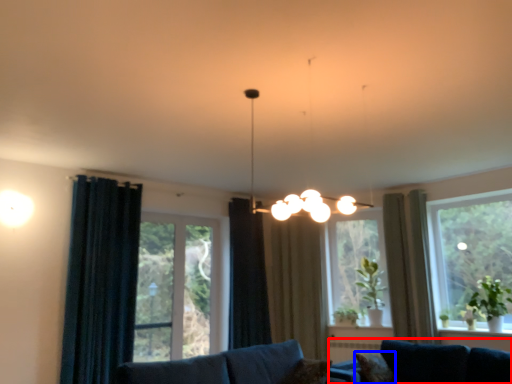
Question: Which of the following is the closest to the observer, studio couch (highlighted by a red box) or pillow (highlighted by a blue box)?

Choices:
 (A) studio couch
 (B) pillow

Answer: (A)